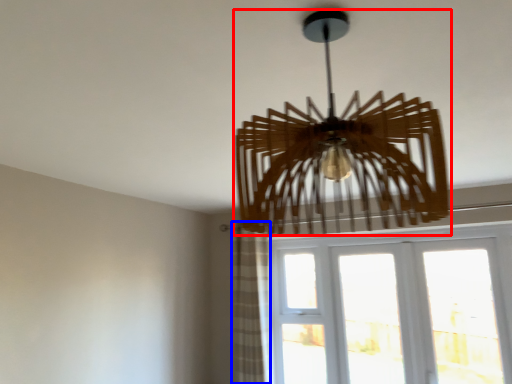
Question: Which of the following is the closest to the observer, lamp (highlighted by a red box) or curtain (highlighted by a blue box)?

Choices:
 (A) lamp
 (B) curtain

Answer: (A)